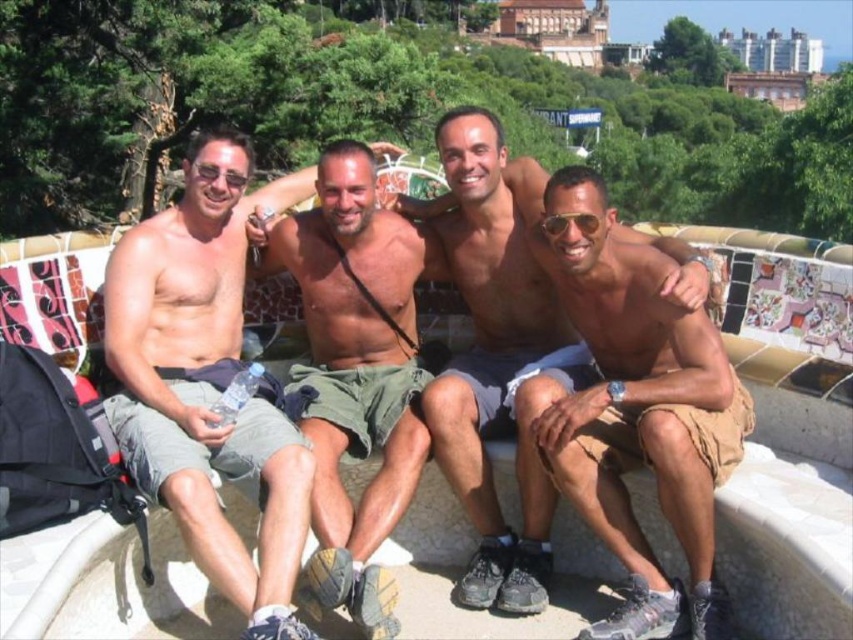
Question: Can you confirm if white mosaic bench at center is smaller than green cotton shorts at center?

Choices:
 (A) no
 (B) yes

Answer: (A)

Question: Which of the following is the farthest from the observer?

Choices:
 (A) white mosaic bench at center
 (B) tan fabric shorts at right

Answer: (B)

Question: Which point appears farthest from the camera in this image?

Choices:
 (A) (219, 442)
 (B) (305, 266)

Answer: (B)

Question: Does matte gray shorts at center have a smaller size compared to matte khaki shorts at center?

Choices:
 (A) no
 (B) yes

Answer: (B)

Question: Is white mosaic bench at center to the left of tan fabric shorts at right from the viewer's perspective?

Choices:
 (A) no
 (B) yes

Answer: (B)

Question: Which point is closer to the camera?

Choices:
 (A) (824, 436)
 (B) (286, 472)

Answer: (B)